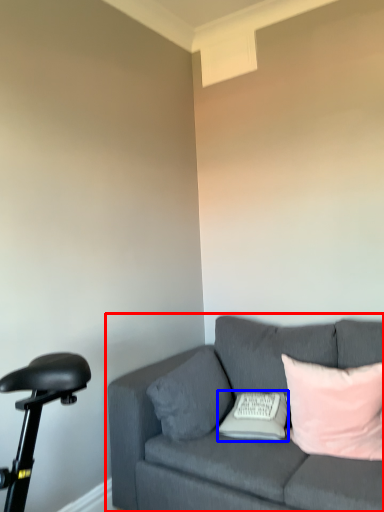
Question: Which object is closer to the camera taking this photo, studio couch (highlighted by a red box) or pillow (highlighted by a blue box)?

Choices:
 (A) studio couch
 (B) pillow

Answer: (A)